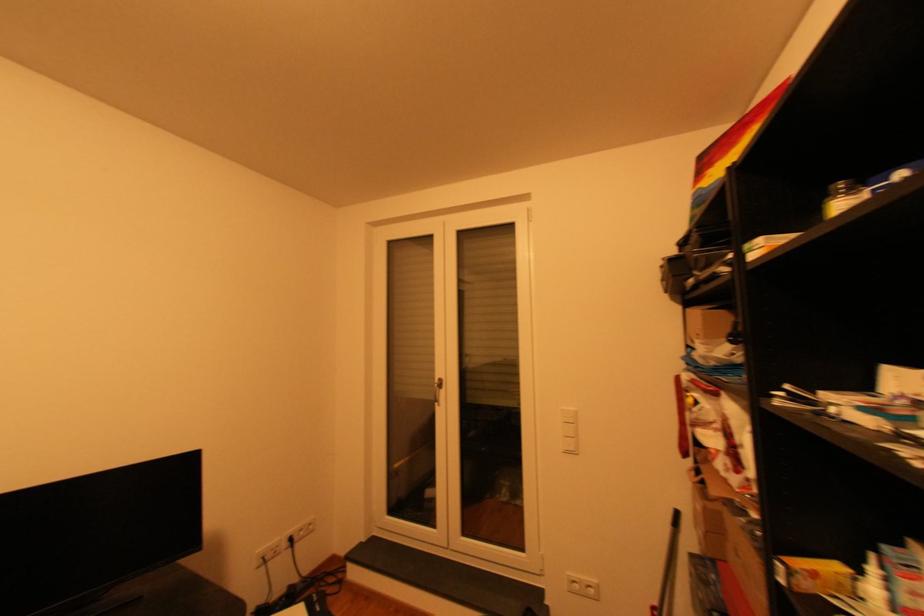
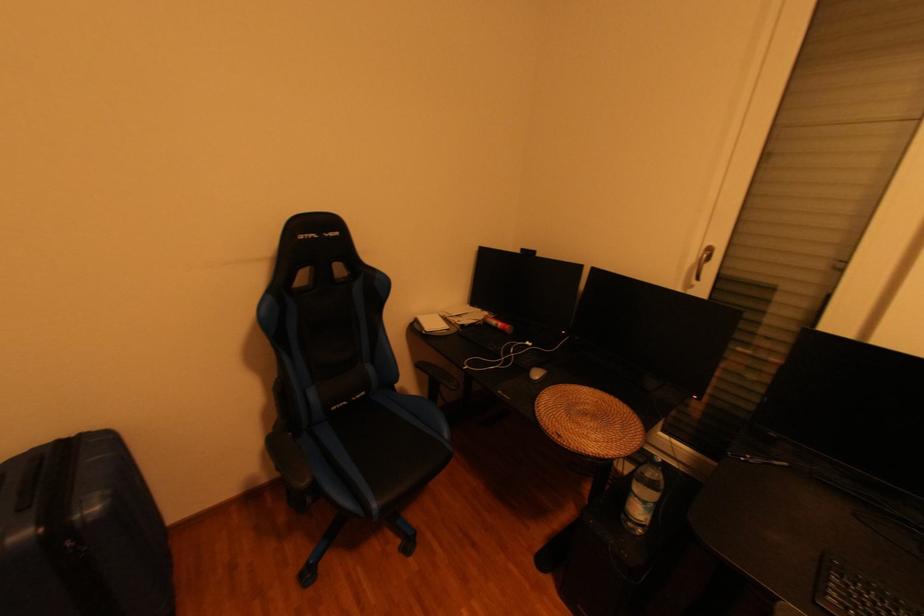
First-person continuous shooting, in which direction is the camera rotating?

The rotation direction of the camera is left-down.